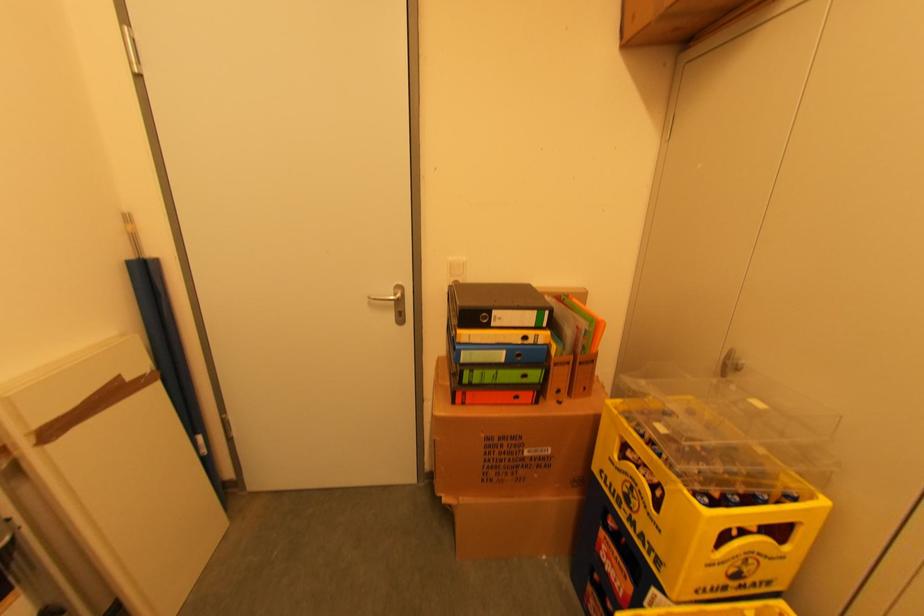
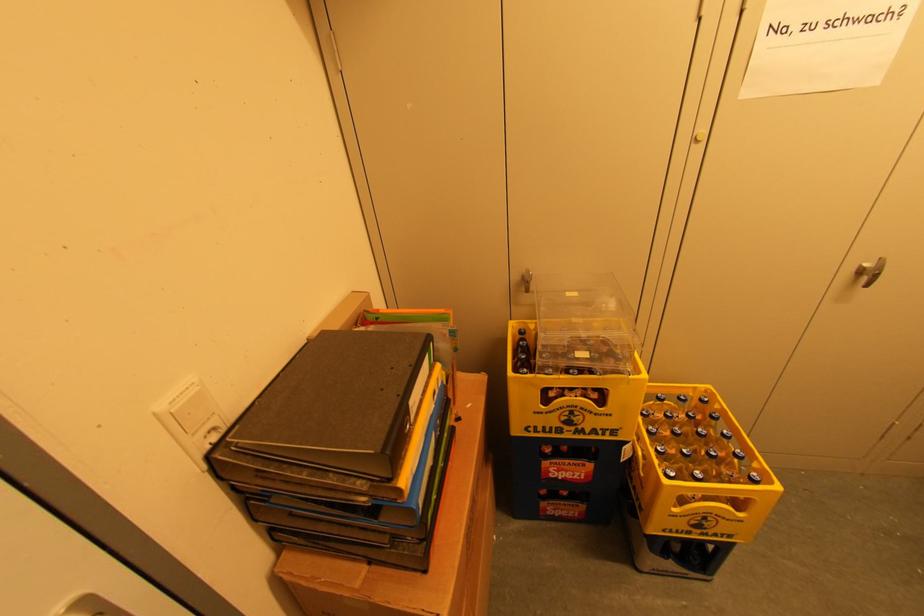
The point at (636, 500) is marked in the first image. Where is the corresponding point in the second image?

(578, 419)